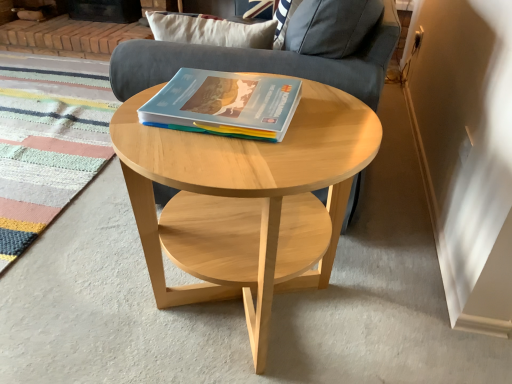
Question: Can you confirm if gray fabric armchair at center is smaller than natural wood coffee table at center?

Choices:
 (A) no
 (B) yes

Answer: (A)

Question: From a real-world perspective, is gray fabric armchair at center on top of natural wood coffee table at center?

Choices:
 (A) no
 (B) yes

Answer: (B)

Question: Is gray fabric armchair at center aimed at natural wood coffee table at center?

Choices:
 (A) no
 (B) yes

Answer: (A)

Question: Is gray fabric armchair at center at the left side of natural wood coffee table at center?

Choices:
 (A) yes
 (B) no

Answer: (B)

Question: From the image's perspective, is gray fabric armchair at center beneath natural wood coffee table at center?

Choices:
 (A) no
 (B) yes

Answer: (A)

Question: Considering the positions of natural wood coffee table at center and matte plastic book at center in the image, is natural wood coffee table at center bigger or smaller than matte plastic book at center?

Choices:
 (A) big
 (B) small

Answer: (A)

Question: From a real-world perspective, is natural wood coffee table at center above or below matte plastic book at center?

Choices:
 (A) above
 (B) below

Answer: (B)

Question: From the image's perspective, relative to matte plastic book at center, is natural wood coffee table at center above or below?

Choices:
 (A) below
 (B) above

Answer: (A)

Question: Is natural wood coffee table at center inside or outside of matte plastic book at center?

Choices:
 (A) outside
 (B) inside

Answer: (A)

Question: Based on their sizes in the image, would you say natural wood coffee table at center is bigger or smaller than gray fabric armchair at center?

Choices:
 (A) small
 (B) big

Answer: (A)

Question: Which is correct: natural wood coffee table at center is inside gray fabric armchair at center, or outside of it?

Choices:
 (A) outside
 (B) inside

Answer: (A)

Question: From their relative heights in the image, would you say natural wood coffee table at center is taller or shorter than gray fabric armchair at center?

Choices:
 (A) tall
 (B) short

Answer: (B)

Question: Visually, is natural wood coffee table at center positioned to the left or to the right of gray fabric armchair at center?

Choices:
 (A) right
 (B) left

Answer: (B)

Question: In terms of height, does matte plastic book at center look taller or shorter compared to multicolored woven mat at lower left?

Choices:
 (A) tall
 (B) short

Answer: (A)

Question: Looking at their shapes, would you say matte plastic book at center is wider or thinner than multicolored woven mat at lower left?

Choices:
 (A) wide
 (B) thin

Answer: (B)